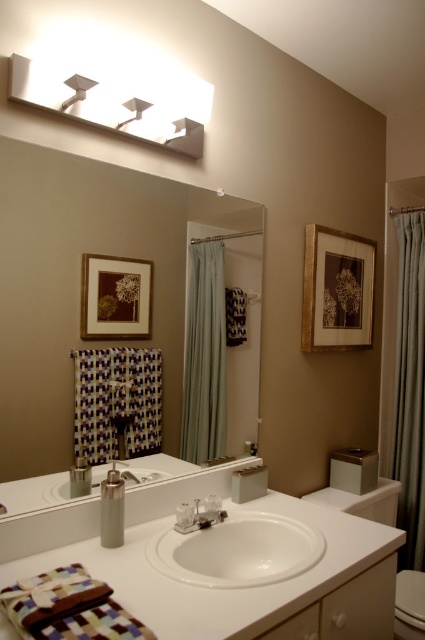
Question: Is clear glass mirror at center wider than matte gray curtain at right?

Choices:
 (A) no
 (B) yes

Answer: (B)

Question: Does clear glass mirror at center have a larger size compared to white glossy sink at center?

Choices:
 (A) no
 (B) yes

Answer: (B)

Question: Which point is farther to the camera?

Choices:
 (A) (31, 280)
 (B) (156, 570)
 (C) (203, 502)
 (D) (87, 81)

Answer: (C)

Question: Can you confirm if white glossy sink at center is thinner than matte gray curtain at right?

Choices:
 (A) yes
 (B) no

Answer: (B)

Question: Considering the real-world distances, which object is closest to the matte gray curtain at right?

Choices:
 (A) clear glass mirror at center
 (B) white matte light fixture at upper center

Answer: (A)

Question: Among these points, which one is nearest to the camera?

Choices:
 (A) (416, 467)
 (B) (180, 528)
 (C) (201, 148)

Answer: (B)